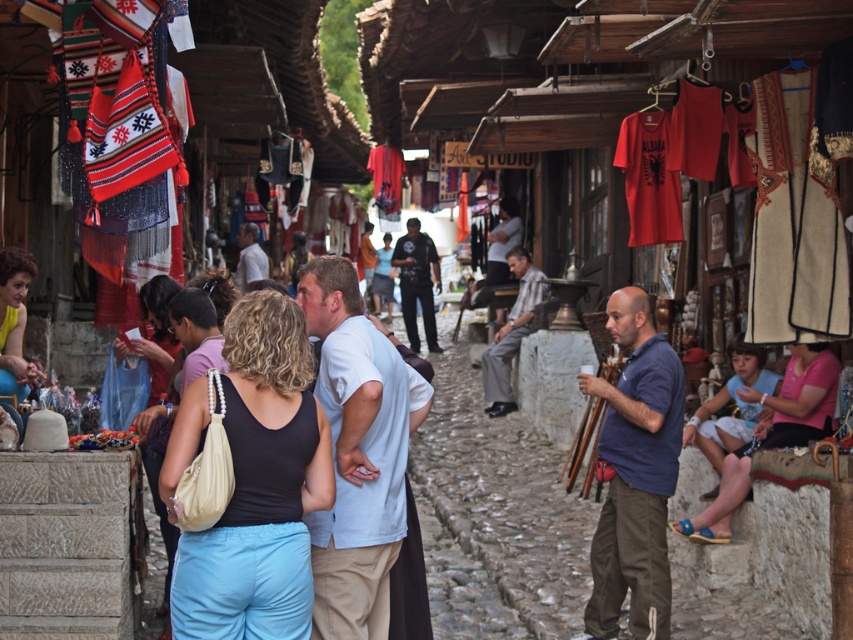
Is black fabric tank top at center smaller than yellow fabric blouse at center?

Indeed, black fabric tank top at center has a smaller size compared to yellow fabric blouse at center.

Is black fabric tank top at center wider than yellow fabric blouse at center?

Indeed, black fabric tank top at center has a greater width compared to yellow fabric blouse at center.

At what (x,y) coordinates should I click in order to perform the action: click on black fabric tank top at center. Please return your answer as a coordinate pair (x, y). Image resolution: width=853 pixels, height=640 pixels. Looking at the image, I should click on (260, 486).

Between black fabric tank top at center and matte black tank top at center, which one has more height?

Standing taller between the two is black fabric tank top at center.

This screenshot has width=853, height=640. What do you see at coordinates (260, 486) in the screenshot?
I see `black fabric tank top at center` at bounding box center [260, 486].

Is point (167, 444) positioned in front of point (177, 362)?

Yes, point (167, 444) is closer to viewer.

This screenshot has height=640, width=853. I want to click on black fabric tank top at center, so click(260, 486).

Measure the distance between denim shorts at lower right and yellow fabric blouse at center.

denim shorts at lower right and yellow fabric blouse at center are 5.75 meters apart from each other.

Does denim shorts at lower right appear on the right side of yellow fabric blouse at center?

Yes, denim shorts at lower right is to the right of yellow fabric blouse at center.

At what (x,y) coordinates should I click in order to perform the action: click on denim shorts at lower right. Please return your answer as a coordinate pair (x, y). Image resolution: width=853 pixels, height=640 pixels. Looking at the image, I should click on (798, 397).